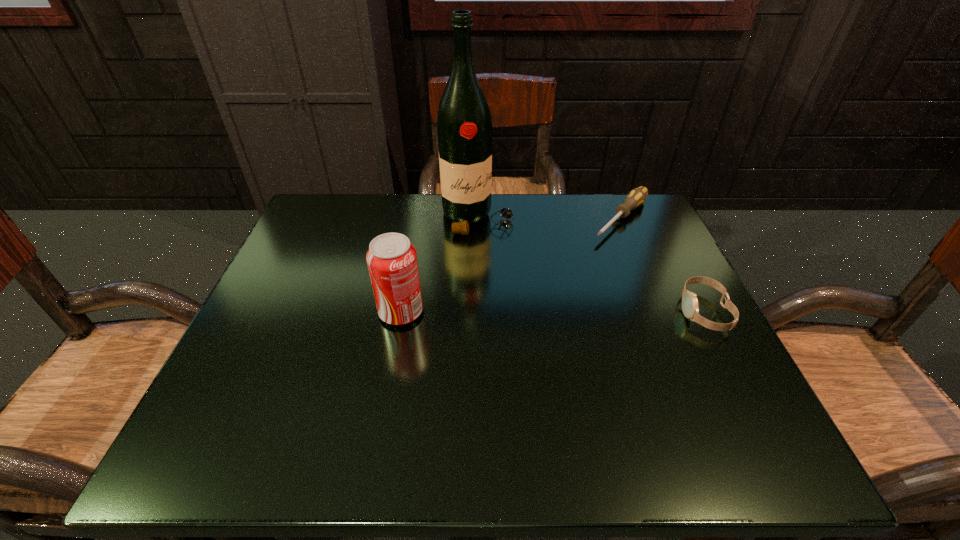
Where is `unoccupied position between the second object from left to right and the soda can`? Image resolution: width=960 pixels, height=540 pixels. unoccupied position between the second object from left to right and the soda can is located at coordinates (439, 265).

Find the location of a particular element. Image resolution: width=960 pixels, height=540 pixels. empty space that is in between the soda can and the third tallest object is located at coordinates (553, 312).

Where is `empty space between the wine bottle and the third tallest object`? empty space between the wine bottle and the third tallest object is located at coordinates (590, 265).

Image resolution: width=960 pixels, height=540 pixels. What are the coordinates of `free space between the screwdriver and the second shortest object` in the screenshot? It's located at (662, 265).

You are a GUI agent. You are given a task and a screenshot of the screen. Output one action in this format:
    pyautogui.click(x=<x>, y=<y>)
    Task: Click on the empty space between the third shortest object and the second shortest object
    
    Given the screenshot: What is the action you would take?
    pyautogui.click(x=553, y=312)

The height and width of the screenshot is (540, 960). Find the location of `blank region between the screwdriver and the leftmost object`. blank region between the screwdriver and the leftmost object is located at coordinates click(512, 265).

Identify the location of free space between the leftmost object and the second shortest object. The height and width of the screenshot is (540, 960). (553, 312).

Where is `free space between the shortest object and the watch`? free space between the shortest object and the watch is located at coordinates (662, 265).

At what (x,y) coordinates should I click in order to perform the action: click on vacant point located between the screwdriver and the second shortest object. Please return your answer as a coordinate pair (x, y). The height and width of the screenshot is (540, 960). Looking at the image, I should click on (662, 265).

Select which object appears as the third closest to the watch. Please provide its 2D coordinates. Your answer should be formatted as a tuple, i.e. [(x, y)], where the tuple contains the x and y coordinates of a point satisfying the conditions above.

[(392, 262)]